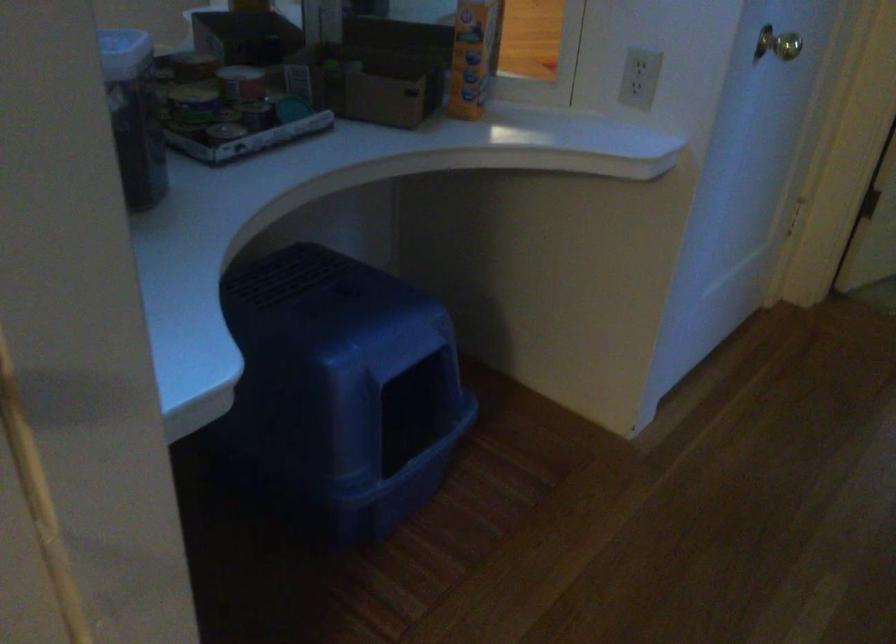
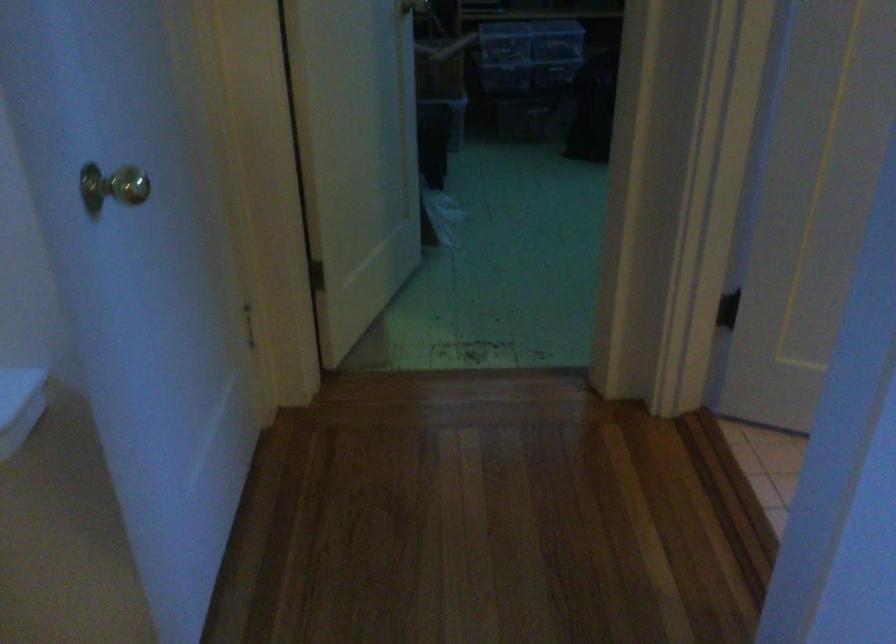
Question: The first image is from the beginning of the video and the second image is from the end. How did the camera likely rotate when shooting the video?

Choices:
 (A) Left
 (B) Right
 (C) Up
 (D) Down

Answer: (B)